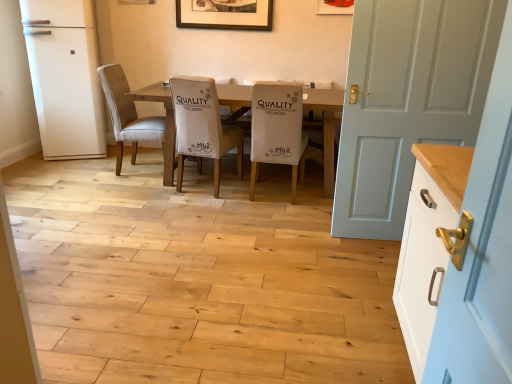
Locate an element on the screen. The image size is (512, 384). wooden table at center is located at coordinates (327, 128).

At what (x,y) coordinates should I click in order to perform the action: click on matte white picture frame at upper center, the first picture frame when ordered from front to back. Please return your answer as a coordinate pair (x, y). Image resolution: width=512 pixels, height=384 pixels. Looking at the image, I should click on (335, 7).

Image resolution: width=512 pixels, height=384 pixels. Describe the element at coordinates (202, 126) in the screenshot. I see `white fabric chair at center, which appears as the second chair when viewed from the right` at that location.

The image size is (512, 384). What do you see at coordinates (428, 242) in the screenshot? I see `white painted wood cabinet at right` at bounding box center [428, 242].

Locate an element on the screen. The height and width of the screenshot is (384, 512). wooden table at center is located at coordinates (327, 128).

Is white painted wood cabinet at right looking in the opposite direction of suede beige chair at center, the 3th chair in the right-to-left sequence?

No, white painted wood cabinet at right is not facing the opposite direction of suede beige chair at center, the 3th chair in the right-to-left sequence.

Considering the sizes of objects white painted wood cabinet at right and suede beige chair at center, the 3th chair in the right-to-left sequence, in the image provided, who is wider, white painted wood cabinet at right or suede beige chair at center, the 3th chair in the right-to-left sequence,?

Wider between the two is suede beige chair at center, the 3th chair in the right-to-left sequence.

Which point is more distant from viewer, (432, 270) or (111, 117)?

Point (111, 117)

Consider the image. How many degrees apart are the facing directions of white painted wood cabinet at right and suede beige chair at center, the 3th chair in the right-to-left sequence?

The facing directions of white painted wood cabinet at right and suede beige chair at center, the 3th chair in the right-to-left sequence, are 180 degrees apart.

From a real-world perspective, is wooden picture frame at upper center, the 2th picture frame from the front, beneath suede beige chair at center, the first chair from the left?

No, from a real-world perspective, wooden picture frame at upper center, the 2th picture frame from the front, is not under suede beige chair at center, the first chair from the left.

Looking at the image, does wooden picture frame at upper center, which appears as the first picture frame when viewed from the back, seem bigger or smaller compared to suede beige chair at center, the first chair from the left?

Clearly, wooden picture frame at upper center, which appears as the first picture frame when viewed from the back, is smaller in size than suede beige chair at center, the first chair from the left.

From the picture: Is wooden picture frame at upper center, which appears as the first picture frame when viewed from the back, not inside suede beige chair at center, the first chair from the left?

Absolutely, wooden picture frame at upper center, which appears as the first picture frame when viewed from the back, is external to suede beige chair at center, the first chair from the left.

Would you say white fabric chair at center, which appears as the second chair when viewed from the right, is to the left or to the right of white painted wood cabinet at right in the picture?

Based on their positions, white fabric chair at center, which appears as the second chair when viewed from the right, is located to the left of white painted wood cabinet at right.

Is white fabric chair at center, which appears as the second chair when viewed from the right, bigger or smaller than white painted wood cabinet at right?

white fabric chair at center, which appears as the second chair when viewed from the right, is bigger than white painted wood cabinet at right.

Considering the relative sizes of white fabric chair at center, which is the 2th chair from left to right, and white painted wood cabinet at right in the image provided, is white fabric chair at center, which is the 2th chair from left to right, shorter than white painted wood cabinet at right?

Correct, white fabric chair at center, which is the 2th chair from left to right, is not as tall as white painted wood cabinet at right.

Can you tell me how much suede beige chair at center, the 3th chair in the right-to-left sequence, and wooden table at center differ in facing direction?

90 degrees separate the facing orientations of suede beige chair at center, the 3th chair in the right-to-left sequence, and wooden table at center.

Between suede beige chair at center, the first chair from the left, and wooden table at center, which one is positioned in front?

wooden table at center.

Does suede beige chair at center, the 3th chair in the right-to-left sequence, have a smaller size compared to wooden table at center?

Yes.

From a real-world perspective, is suede beige chair at center, the 3th chair in the right-to-left sequence, physically located above or below wooden table at center?

From a real-world perspective, suede beige chair at center, the 3th chair in the right-to-left sequence, is physically above wooden table at center.

Looking at their sizes, would you say beige fabric chair at center, the 1th chair in the right-to-left sequence, is wider or thinner than wooden picture frame at upper center, which appears as the first picture frame when viewed from the back?

Clearly, beige fabric chair at center, the 1th chair in the right-to-left sequence, has more width compared to wooden picture frame at upper center, which appears as the first picture frame when viewed from the back.

Is beige fabric chair at center, the 1th chair in the right-to-left sequence, at the right side of wooden picture frame at upper center, positioned as the first picture frame in left-to-right order?

Yes, beige fabric chair at center, the 1th chair in the right-to-left sequence, is to the right of wooden picture frame at upper center, positioned as the first picture frame in left-to-right order.

Is the depth of white fabric chair at center, which appears as the second chair when viewed from the right, greater than that of matte white picture frame at upper center, which is the first picture frame in right-to-left order?

That is False.

From the image's perspective, starting from the matte white picture frame at upper center, arranged as the second picture frame when viewed from the left, which chair is the 2nd one below? Please provide its 2D coordinates.

[(202, 126)]

Looking at this image, from the image's perspective, which is below, white fabric chair at center, which appears as the second chair when viewed from the right, or matte white picture frame at upper center, arranged as the second picture frame when viewed from the left?

From the image's view, white fabric chair at center, which appears as the second chair when viewed from the right, is below.

Between white fabric chair at center, which appears as the second chair when viewed from the right, and matte white picture frame at upper center, marked as the 2th picture frame in a back-to-front arrangement, which one appears on the left side from the viewer's perspective?

white fabric chair at center, which appears as the second chair when viewed from the right.

How distant is white matte refrigerator at left from white fabric chair at center, which is the 2th chair from left to right?

A distance of 4.77 feet exists between white matte refrigerator at left and white fabric chair at center, which is the 2th chair from left to right.

From the image's perspective, is white matte refrigerator at left above or below white fabric chair at center, which is the 2th chair from left to right?

white matte refrigerator at left is situated higher than white fabric chair at center, which is the 2th chair from left to right, in the image.

Choose the correct answer: Is white matte refrigerator at left inside white fabric chair at center, which appears as the second chair when viewed from the right, or outside it?

white matte refrigerator at left is not inside white fabric chair at center, which appears as the second chair when viewed from the right, it's outside.

Is white matte refrigerator at left oriented away from white fabric chair at center, which is the 2th chair from left to right?

white matte refrigerator at left does not have its back to white fabric chair at center, which is the 2th chair from left to right.

The image size is (512, 384). I want to click on the 3rd chair behind when counting from the white painted wood cabinet at right, so click(x=127, y=114).

This screenshot has width=512, height=384. Identify the location of picture frame that is the 1st one above the suede beige chair at center, the 3th chair in the right-to-left sequence (from a real-world perspective). (225, 14).

Estimate the real-world distances between objects in this image. Which object is closer to suede beige chair at center, the first chair from the left, wooden table at center or white painted wood cabinet at right?

wooden table at center is closer to suede beige chair at center, the first chair from the left.

From the image, which object appears to be nearer to matte white picture frame at upper center, which is the first picture frame in right-to-left order, wooden table at center or white matte refrigerator at left?

Based on the image, wooden table at center appears to be nearer to matte white picture frame at upper center, which is the first picture frame in right-to-left order.

Which object lies further to the anchor point white painted wood door at right, wooden picture frame at upper center, which ranks as the 2th picture frame in right-to-left order, or beige fabric chair at center, the 1th chair in the right-to-left sequence?

wooden picture frame at upper center, which ranks as the 2th picture frame in right-to-left order.

Based on the photo, estimate the real-world distances between objects in this image. Which object is closer to beige fabric chair at center, arranged as the third chair when viewed from the left, wooden picture frame at upper center, which appears as the first picture frame when viewed from the back, or suede beige chair at center, the first chair from the left?

suede beige chair at center, the first chair from the left, is closer to beige fabric chair at center, arranged as the third chair when viewed from the left.

Estimate the real-world distances between objects in this image. Which object is closer to white painted wood door at right, white matte refrigerator at left or suede beige chair at center, the 3th chair in the right-to-left sequence?

suede beige chair at center, the 3th chair in the right-to-left sequence, is positioned closer to the anchor white painted wood door at right.

Which object lies nearer to the anchor point suede beige chair at center, the first chair from the left, wooden table at center or wooden picture frame at upper center, which appears as the first picture frame when viewed from the back?

wooden table at center.

Considering their positions, is matte white picture frame at upper center, arranged as the second picture frame when viewed from the left, positioned further to wooden picture frame at upper center, positioned as the first picture frame in left-to-right order, than white matte refrigerator at left?

Among the two, white matte refrigerator at left is located further to wooden picture frame at upper center, positioned as the first picture frame in left-to-right order.

Based on their spatial positions, is white painted wood door at right or suede beige chair at center, the first chair from the left, further from white painted wood cabinet at right?

suede beige chair at center, the first chair from the left, is further to white painted wood cabinet at right.

Locate an element on the screen. The height and width of the screenshot is (384, 512). kitchen & dining room table between white painted wood cabinet at right and wooden picture frame at upper center, positioned as the first picture frame in left-to-right order, in the front-back direction is located at coordinates 327,128.

Identify the location of door positioned between white painted wood cabinet at right and beige fabric chair at center, arranged as the third chair when viewed from the left, from near to far. (407, 100).

Locate an element on the screen. The height and width of the screenshot is (384, 512). fridge between white painted wood cabinet at right and wooden picture frame at upper center, which ranks as the 2th picture frame in right-to-left order, from front to back is located at coordinates (65, 78).

You are a GUI agent. You are given a task and a screenshot of the screen. Output one action in this format:
    pyautogui.click(x=<x>, y=<y>)
    Task: Click on the chair that lies between wooden picture frame at upper center, positioned as the first picture frame in left-to-right order, and wooden table at center from top to bottom
    
    Given the screenshot: What is the action you would take?
    pyautogui.click(x=127, y=114)